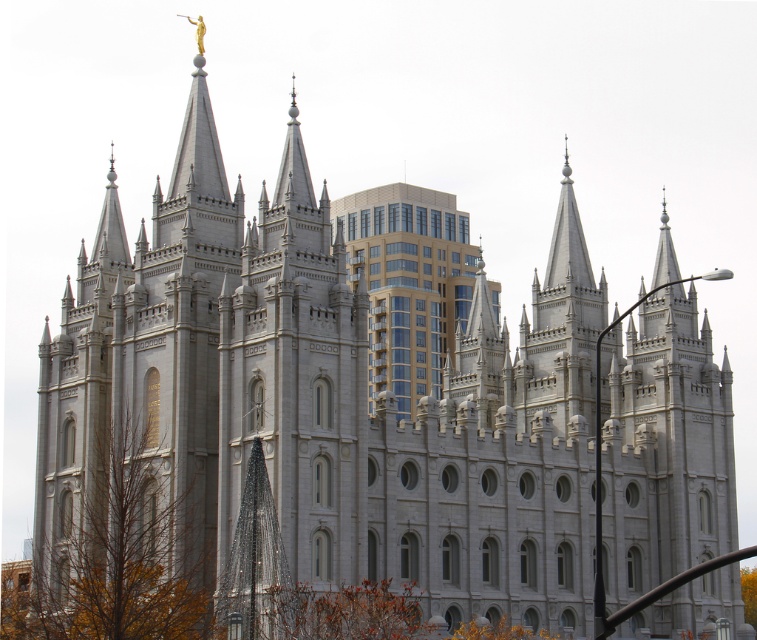
Question: Can you confirm if brown leafy tree at lower center is positioned to the right of green leafy tree at lower right?

Choices:
 (A) no
 (B) yes

Answer: (A)

Question: Which object appears closest to the camera in this image?

Choices:
 (A) brown leafy tree at lower left
 (B) green leafy tree at lower right

Answer: (A)

Question: Which point is closer to the camera?

Choices:
 (A) (291, 621)
 (B) (120, 444)
 (C) (746, 605)

Answer: (A)

Question: Does golden-brown foliage at lower center have a lesser width compared to green leafy tree at lower right?

Choices:
 (A) no
 (B) yes

Answer: (B)

Question: Is brown leafy tree at lower center further to the viewer compared to golden-brown foliage at lower center?

Choices:
 (A) no
 (B) yes

Answer: (A)

Question: Estimate the real-world distances between objects in this image. Which object is farther from the brown leafy tree at lower center?

Choices:
 (A) green leafy tree at lower right
 (B) brown leafy tree at lower left

Answer: (A)